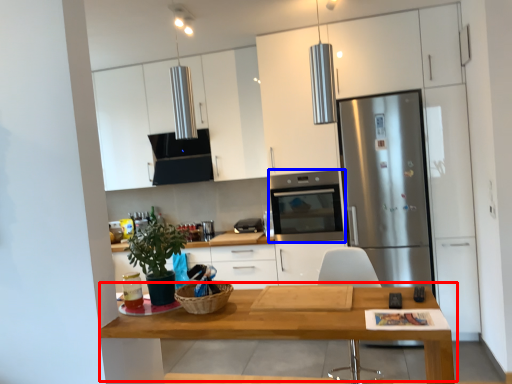
Question: Which point is further to the camera, table (highlighted by a red box) or kitchen appliance (highlighted by a blue box)?

Choices:
 (A) table
 (B) kitchen appliance

Answer: (B)